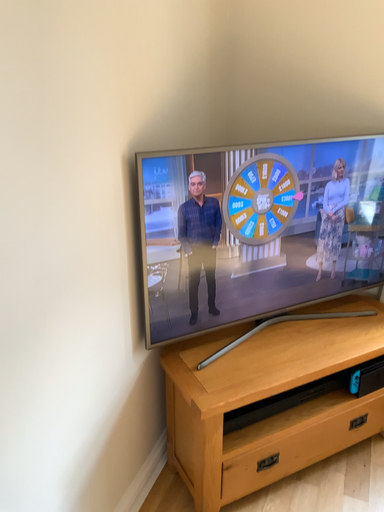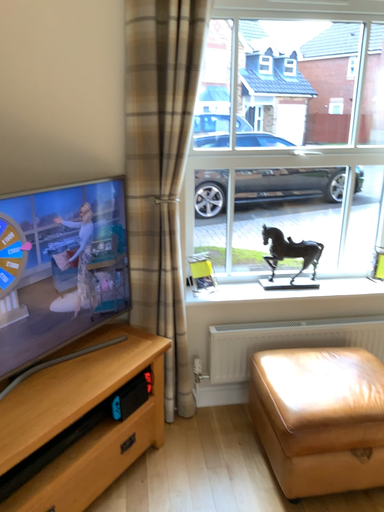
Question: How did the camera likely rotate when shooting the video?

Choices:
 (A) rotated right
 (B) rotated left

Answer: (A)